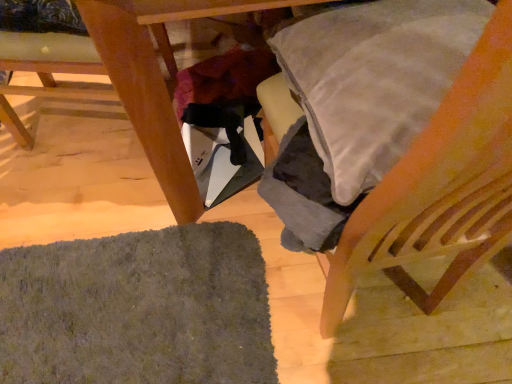
The height and width of the screenshot is (384, 512). Describe the element at coordinates (138, 309) in the screenshot. I see `dark gray shaggy mat at lower left` at that location.

Measure the distance between point (493,184) and camera.

Point (493,184) and camera are 18.58 inches apart.

The image size is (512, 384). In order to click on dark gray shaggy mat at lower left in this screenshot , I will do `click(138, 309)`.

Would you say wooden chair at right, placed as the first chair when sorted from right to left, is part of dark gray shaggy mat at lower left's contents?

No, wooden chair at right, placed as the first chair when sorted from right to left, is not surrounded by dark gray shaggy mat at lower left.

Does dark gray shaggy mat at lower left turn towards wooden chair at right, the 2th chair viewed from the left?

No, dark gray shaggy mat at lower left is not aimed at wooden chair at right, the 2th chair viewed from the left.

Is dark gray shaggy mat at lower left positioned far away from wooden chair at right, the 2th chair viewed from the left?

No, dark gray shaggy mat at lower left is not far away from wooden chair at right, the 2th chair viewed from the left.

In the scene shown: Between dark gray shaggy mat at lower left and wooden chair at right, placed as the first chair when sorted from right to left, which one has less height?

dark gray shaggy mat at lower left.

Where is `mat on the right of the wooden chair at lower left, positioned as the 1th chair in left-to-right order`? This screenshot has height=384, width=512. mat on the right of the wooden chair at lower left, positioned as the 1th chair in left-to-right order is located at coordinates (138, 309).

Does point (24, 305) lie behind point (9, 117)?

No, (24, 305) is in front of (9, 117).

Does dark gray shaggy mat at lower left have a larger size compared to wooden chair at lower left, the 2th chair in the right-to-left sequence?

No, dark gray shaggy mat at lower left is not bigger than wooden chair at lower left, the 2th chair in the right-to-left sequence.

Is dark gray shaggy mat at lower left positioned far away from wooden chair at lower left, positioned as the 1th chair in left-to-right order?

dark gray shaggy mat at lower left is near wooden chair at lower left, positioned as the 1th chair in left-to-right order, not far away.

Does wooden table at lower left have a smaller size compared to wooden chair at right, the 2th chair viewed from the left?

Incorrect, wooden table at lower left is not smaller in size than wooden chair at right, the 2th chair viewed from the left.

Considering the relative sizes of wooden table at lower left and wooden chair at right, the 2th chair viewed from the left, in the image provided, is wooden table at lower left thinner than wooden chair at right, the 2th chair viewed from the left,?

No.

From the image's perspective, which chair is the 2nd one below the wooden table at lower left? Please provide its 2D coordinates.

[(438, 188)]

Does point (173, 199) come closer to viewer compared to point (390, 256)?

No, (173, 199) is further to viewer.

Is wooden chair at lower left, the 2th chair in the right-to-left sequence, beside wooden table at lower left?

No, wooden chair at lower left, the 2th chair in the right-to-left sequence, is not in contact with wooden table at lower left.

Does wooden chair at lower left, the 2th chair in the right-to-left sequence, have a lesser height compared to wooden table at lower left?

Indeed, wooden chair at lower left, the 2th chair in the right-to-left sequence, has a lesser height compared to wooden table at lower left.

Visually, is wooden chair at lower left, positioned as the 1th chair in left-to-right order, positioned to the left or to the right of wooden table at lower left?

Based on their positions, wooden chair at lower left, positioned as the 1th chair in left-to-right order, is located to the left of wooden table at lower left.

Could you measure the distance between wooden chair at lower left, the 2th chair in the right-to-left sequence, and wooden table at lower left?

The distance of wooden chair at lower left, the 2th chair in the right-to-left sequence, from wooden table at lower left is 14.15 inches.

Between wooden table at lower left and dark gray shaggy mat at lower left, which one has more height?

wooden table at lower left.

From the image's perspective, is wooden table at lower left beneath dark gray shaggy mat at lower left?

No.

Is wooden table at lower left next to dark gray shaggy mat at lower left?

No, wooden table at lower left is not making contact with dark gray shaggy mat at lower left.

Find the location of a particular element. table located on the right of dark gray shaggy mat at lower left is located at coordinates (156, 78).

Is wooden chair at right, the 2th chair viewed from the left, not within wooden table at lower left?

Yes.

From a real-world perspective, relative to wooden table at lower left, is wooden chair at right, the 2th chair viewed from the left, vertically above or below?

From a real-world perspective, wooden chair at right, the 2th chair viewed from the left, is physically above wooden table at lower left.

Is wooden chair at right, placed as the first chair when sorted from right to left, positioned in front of wooden table at lower left?

Yes, it is in front of wooden table at lower left.

From a real-world perspective, is dark gray shaggy mat at lower left positioned under wooden table at lower left based on gravity?

Yes, from a real-world perspective, dark gray shaggy mat at lower left is under wooden table at lower left.

In the image, there is a dark gray shaggy mat at lower left. Identify the location of table above it (from the image's perspective). (156, 78).

Which object is positioned more to the right, dark gray shaggy mat at lower left or wooden table at lower left?

wooden table at lower left.

From the image's perspective, starting from the dark gray shaggy mat at lower left, which chair is the 1st one above? Please provide its 2D coordinates.

[(438, 188)]

In order to click on chair lying on the left of dark gray shaggy mat at lower left in this screenshot , I will do `click(48, 72)`.

Which object lies further to the anchor point wooden chair at lower left, the 2th chair in the right-to-left sequence, dark gray shaggy mat at lower left or wooden chair at right, the 2th chair viewed from the left?

wooden chair at right, the 2th chair viewed from the left, lies further to wooden chair at lower left, the 2th chair in the right-to-left sequence, than the other object.

When comparing their distances from wooden chair at lower left, positioned as the 1th chair in left-to-right order, does wooden table at lower left or dark gray shaggy mat at lower left seem closer?

wooden table at lower left lies closer to wooden chair at lower left, positioned as the 1th chair in left-to-right order, than the other object.

Estimate the real-world distances between objects in this image. Which object is closer to dark gray shaggy mat at lower left, wooden table at lower left or wooden chair at lower left, positioned as the 1th chair in left-to-right order?

Based on the image, wooden table at lower left appears to be nearer to dark gray shaggy mat at lower left.

Based on their spatial positions, is wooden chair at lower left, the 2th chair in the right-to-left sequence, or wooden chair at right, placed as the first chair when sorted from right to left, closer to dark gray shaggy mat at lower left?

wooden chair at right, placed as the first chair when sorted from right to left.

From the image, which object appears to be nearer to wooden chair at lower left, the 2th chair in the right-to-left sequence, wooden chair at right, placed as the first chair when sorted from right to left, or dark gray shaggy mat at lower left?

dark gray shaggy mat at lower left lies closer to wooden chair at lower left, the 2th chair in the right-to-left sequence, than the other object.

Looking at the image, which one is located closer to dark gray shaggy mat at lower left, wooden table at lower left or wooden chair at right, placed as the first chair when sorted from right to left?

Among the two, wooden table at lower left is located nearer to dark gray shaggy mat at lower left.

In the scene shown: When comparing their distances from wooden chair at right, the 2th chair viewed from the left, does wooden table at lower left or dark gray shaggy mat at lower left seem closer?

wooden table at lower left is closer to wooden chair at right, the 2th chair viewed from the left.

From the image, which object appears to be nearer to wooden table at lower left, wooden chair at right, placed as the first chair when sorted from right to left, or dark gray shaggy mat at lower left?

dark gray shaggy mat at lower left lies closer to wooden table at lower left than the other object.

I want to click on chair between wooden chair at right, placed as the first chair when sorted from right to left, and dark gray shaggy mat at lower left, along the z-axis, so click(48, 72).

In order to click on table situated between wooden chair at lower left, positioned as the 1th chair in left-to-right order, and wooden chair at right, placed as the first chair when sorted from right to left, from left to right in this screenshot , I will do `click(156, 78)`.